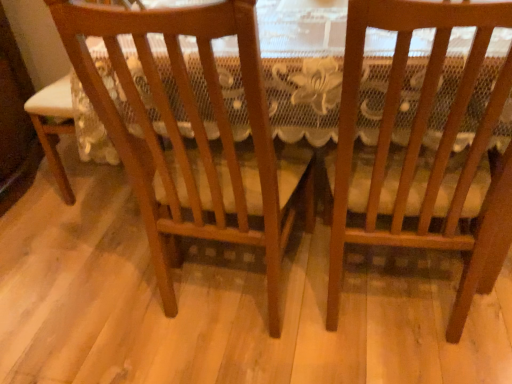
You are a GUI agent. You are given a task and a screenshot of the screen. Output one action in this format:
    pyautogui.click(x=<x>, y=<y>)
    Task: Click on the free space to the left of wooden chair at center, the first chair in the left-to-right sequence
    
    Given the screenshot: What is the action you would take?
    pyautogui.click(x=91, y=292)